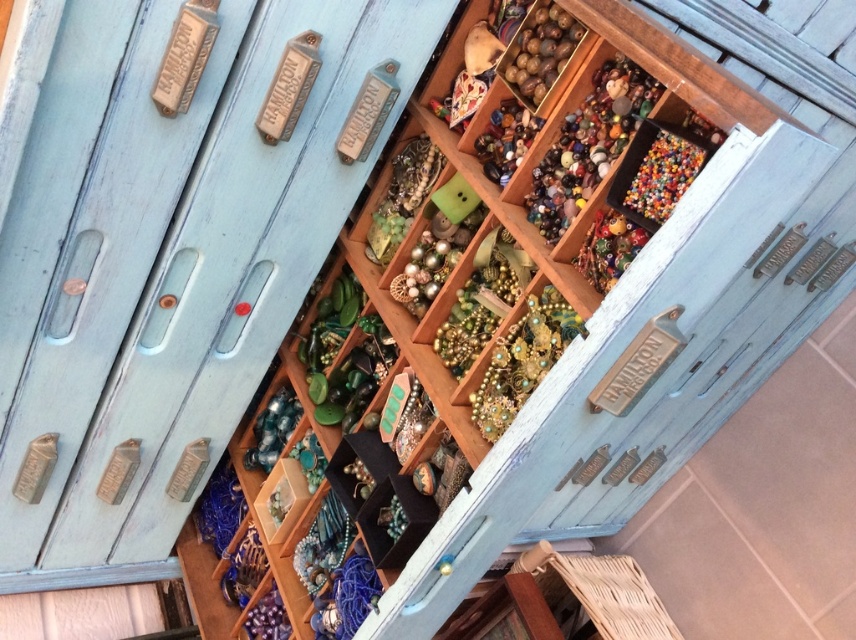
What do you see at coordinates (171, 256) in the screenshot? This screenshot has width=856, height=640. I see `wooden jewelry box at center` at bounding box center [171, 256].

Which is more to the right, wooden jewelry box at center or translucent glass beads at center?

translucent glass beads at center is more to the right.

Is point (149, 269) farther from camera compared to point (556, 141)?

Yes, it is behind point (556, 141).

Where is `wooden jewelry box at center`? wooden jewelry box at center is located at coordinates (171, 256).